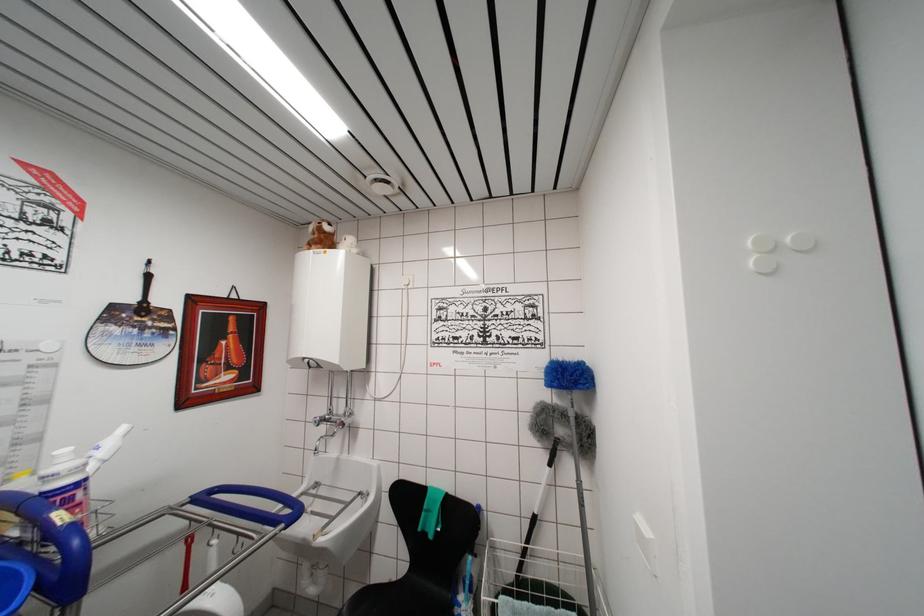
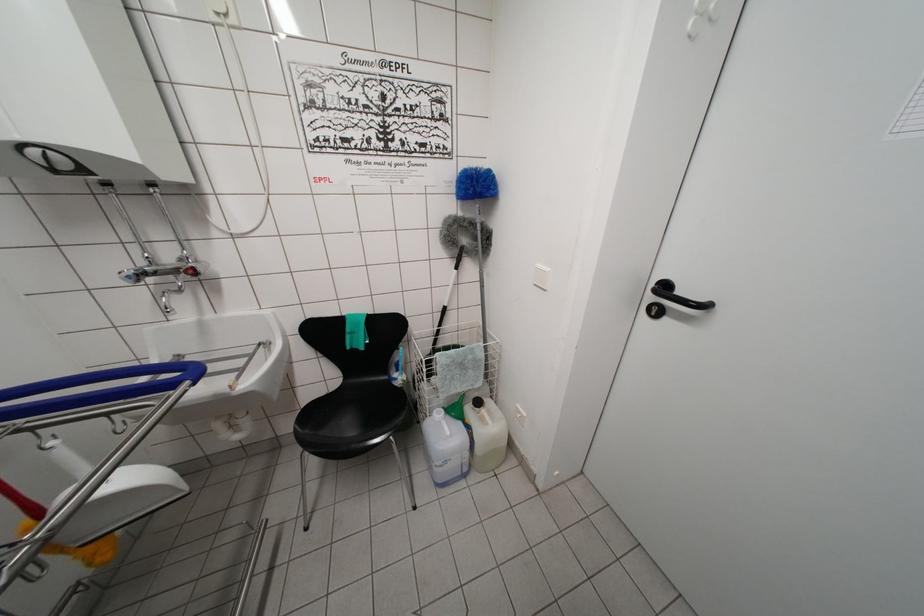
The first image is from the beginning of the video and the second image is from the end. How did the camera likely rotate when shooting the video?

The camera's rotation is toward right-down.